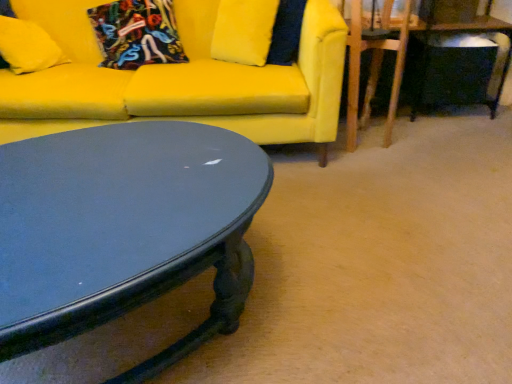
Where is `free spot above glossy dark wood coffee table at lower left (from a real-world perspective)`? free spot above glossy dark wood coffee table at lower left (from a real-world perspective) is located at coordinates (137, 184).